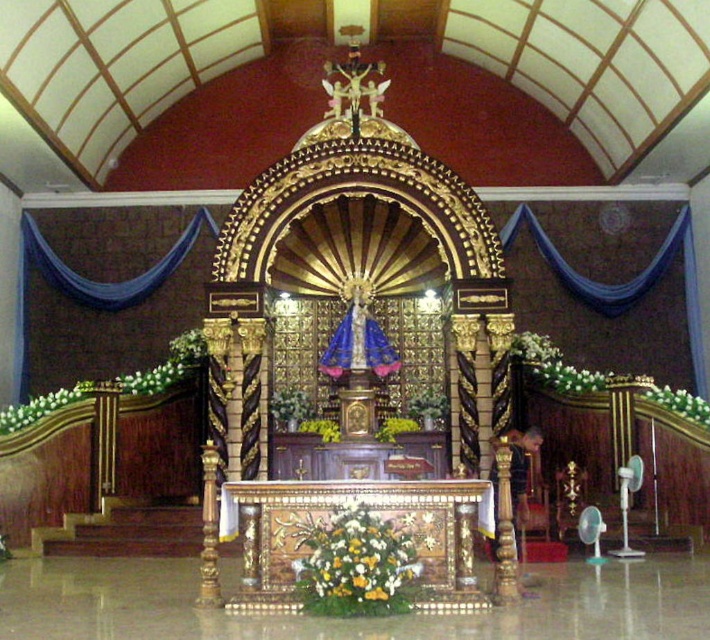
Is point (484, 595) closer to viewer compared to point (349, 556)?

That is False.

Measure the distance between point (349, 499) and camera.

The distance of point (349, 499) from camera is 43.14 meters.

Image resolution: width=710 pixels, height=640 pixels. I want to click on wooden altar at center, so click(x=371, y=513).

The image size is (710, 640). What do you see at coordinates (356, 564) in the screenshot?
I see `yellow fabric flower at center` at bounding box center [356, 564].

At what (x,y) coordinates should I click in order to perform the action: click on yellow fabric flower at center. Please return your answer as a coordinate pair (x, y). This screenshot has height=640, width=710. Looking at the image, I should click on (x=356, y=564).

This screenshot has height=640, width=710. Find the location of `yellow fabric flower at center`. yellow fabric flower at center is located at coordinates (356, 564).

Is point (332, 586) positioned in front of point (694, 397)?

Yes.

Is yellow fabric flower at center thinner than green leafy plant at right?

Yes, yellow fabric flower at center is thinner than green leafy plant at right.

Who is more forward, (383, 532) or (701, 404)?

Point (383, 532) is in front.

Where is `yellow fabric flower at center`? Image resolution: width=710 pixels, height=640 pixels. yellow fabric flower at center is located at coordinates (356, 564).